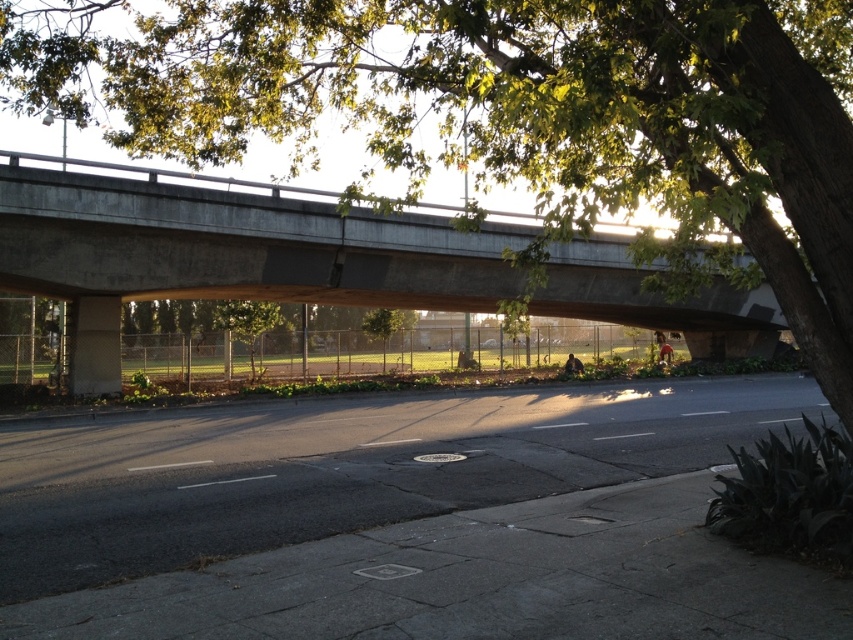
Can you confirm if green leafy tree at upper center is shorter than black asphalt highway at center?

No.

Is green leafy tree at upper center above black asphalt highway at center?

Indeed, green leafy tree at upper center is positioned over black asphalt highway at center.

Locate an element on the screen. green leafy tree at upper center is located at coordinates (518, 115).

Locate an element on the screen. The width and height of the screenshot is (853, 640). green leafy tree at upper center is located at coordinates (518, 115).

Does point (819, 401) come farther from viewer compared to point (328, 296)?

No, it is in front of (328, 296).

From the picture: Who is positioned more to the right, black asphalt highway at center or concrete bridge at upper center?

From the viewer's perspective, concrete bridge at upper center appears more on the right side.

The image size is (853, 640). I want to click on black asphalt highway at center, so click(x=343, y=467).

Consider the image. Can you confirm if green leafy tree at upper center is taller than concrete bridge at upper center?

Indeed, green leafy tree at upper center has a greater height compared to concrete bridge at upper center.

Which is in front, point (131, 131) or point (576, 272)?

Positioned in front is point (576, 272).

At what (x,y) coordinates should I click in order to perform the action: click on green leafy tree at upper center. Please return your answer as a coordinate pair (x, y). Image resolution: width=853 pixels, height=640 pixels. Looking at the image, I should click on (518, 115).